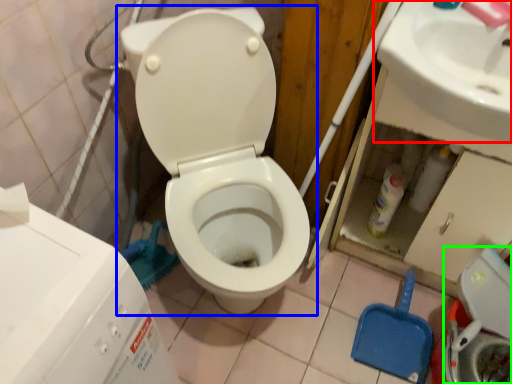
Question: Which is farther away from sink (highlighted by a red box)? toilet (highlighted by a blue box) or washer (highlighted by a green box)?

Choices:
 (A) toilet
 (B) washer

Answer: (B)